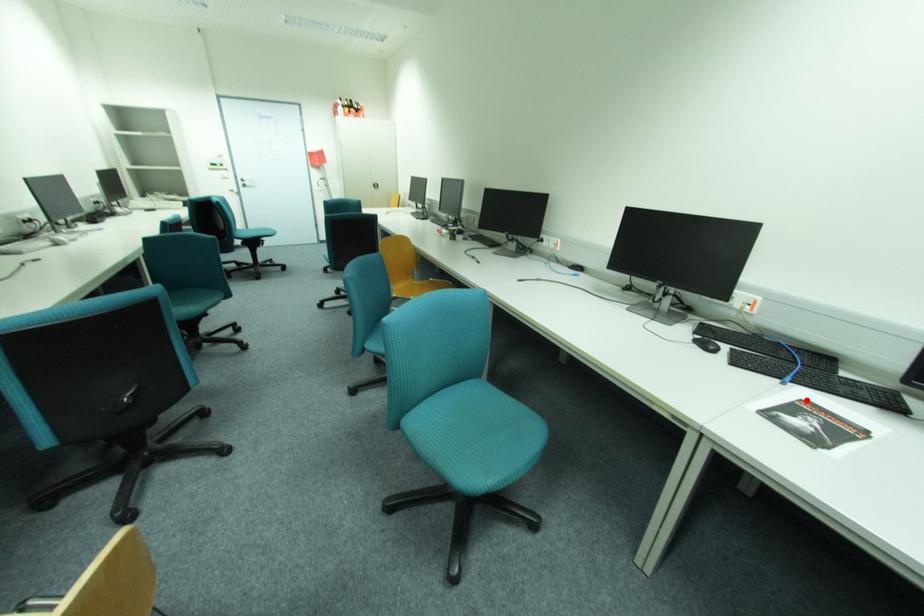
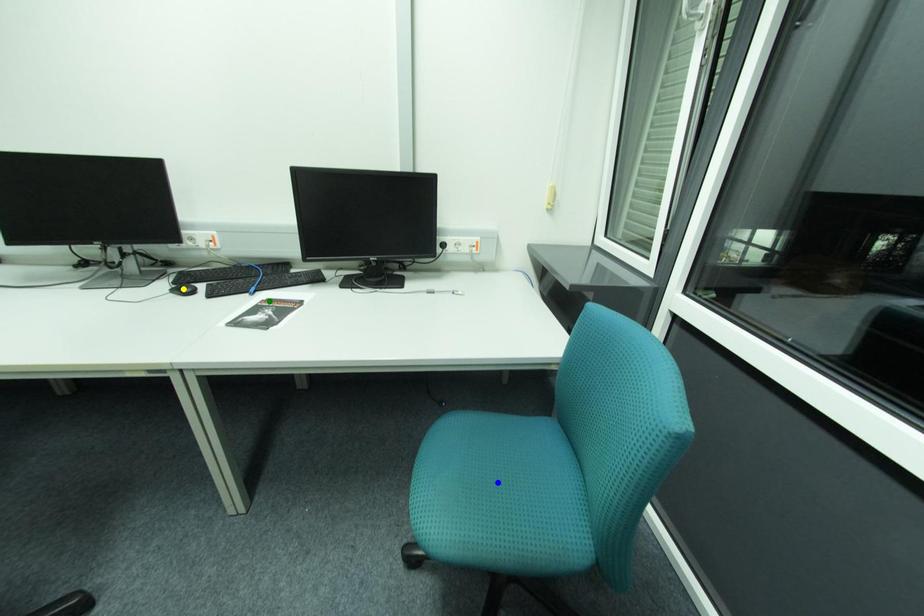
Question: I am providing you with two images of the same scene from different viewpoints. A red point is marked on the first image. You are given multiple points on the second image. Which point in image 2 is actually the same real-world point as the red point in image 1?

Choices:
 (A) blue point
 (B) yellow point
 (C) green point

Answer: (C)